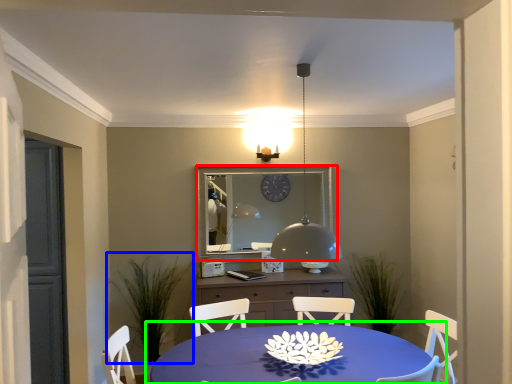
Question: Which object is the closest to the mirror (highlighted by a red box)? Choose among these: plant (highlighted by a blue box) or table (highlighted by a green box).

Choices:
 (A) plant
 (B) table

Answer: (A)